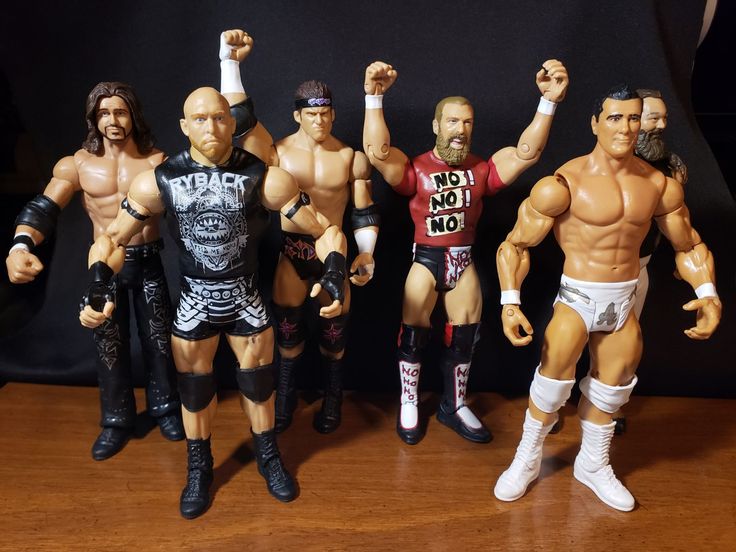
Find the location of `action figures`. action figures is located at coordinates (612, 229), (654, 153), (406, 193), (319, 175), (216, 201), (110, 201).